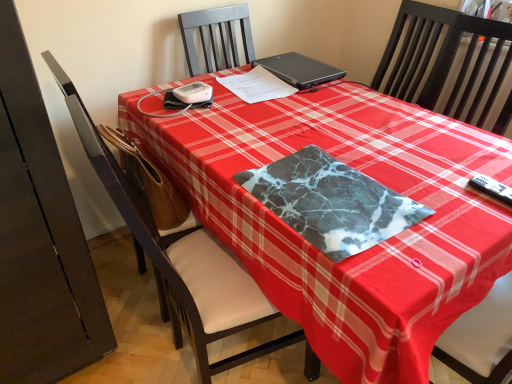
Where is `vacant region above black matte laptop at upper center (from a real-world perspective)`? vacant region above black matte laptop at upper center (from a real-world perspective) is located at coordinates (296, 62).